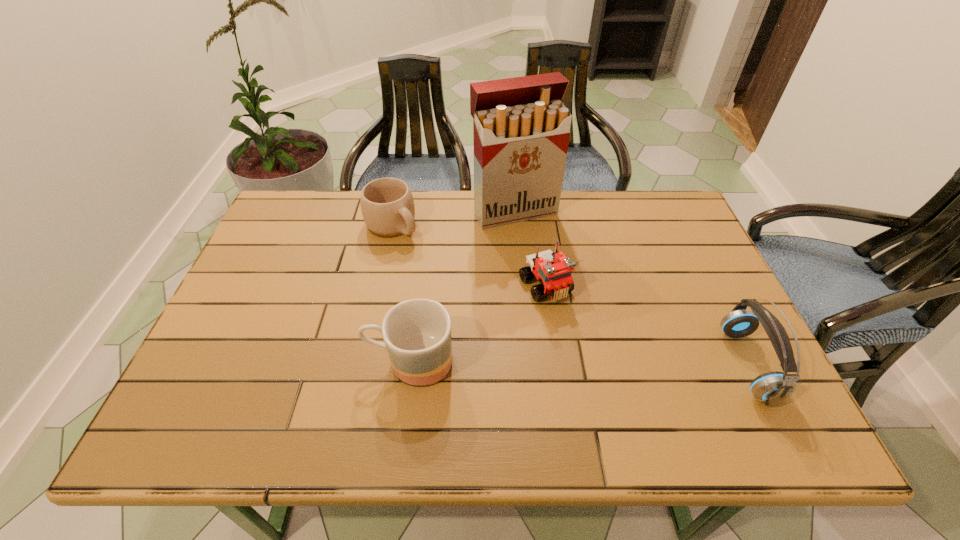
Identify the location of free space that is in between the nearer mug and the Lego. [478, 323].

Locate an element on the screen. object that ranks as the fourth closest to the farther mug is located at coordinates (773, 387).

Locate which object ranks in proximity to the headset. Please provide its 2D coordinates. Your answer should be formatted as a tuple, i.e. [(x, y)], where the tuple contains the x and y coordinates of a point satisfying the conditions above.

[(553, 270)]

Locate an element on the screen. The height and width of the screenshot is (540, 960). blank area in the image that satisfies the following two spatial constraints: 1. on the front side of the Lego; 2. on the ear cups of the headset is located at coordinates (557, 364).

Where is `vacant space that satisfies the following two spatial constraints: 1. on the front side of the third farthest object; 2. on the right side of the farther mug`? vacant space that satisfies the following two spatial constraints: 1. on the front side of the third farthest object; 2. on the right side of the farther mug is located at coordinates (379, 286).

Where is `vacant point that satisfies the following two spatial constraints: 1. on the front side of the headset; 2. on the ear cups of the farther mug`? The width and height of the screenshot is (960, 540). vacant point that satisfies the following two spatial constraints: 1. on the front side of the headset; 2. on the ear cups of the farther mug is located at coordinates (362, 364).